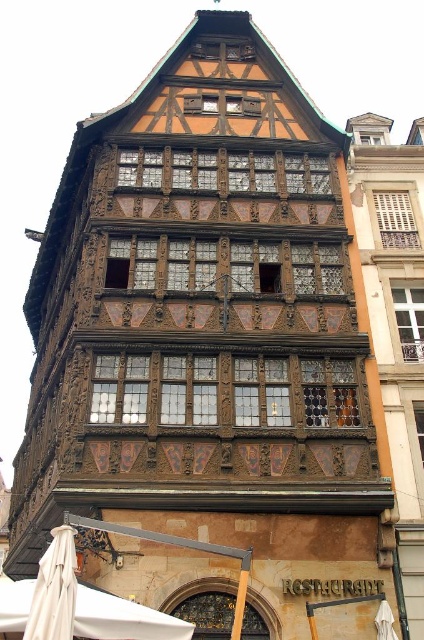
You are a tourist standing in front of the ornate building and notice two umbrellas. The beige fabric umbrella at lower left and the white fabric umbrella at lower right. Which one is taller?

The beige fabric umbrella at lower left is taller than the white fabric umbrella at lower right.

You are standing in front of the ornate building and see a point at coordinates (122, 618). Based on the scene description, what is the object located at that point?

The point at (122, 618) is located on the white fabric canopy at lower left.

You are standing at the entrance of the ornate building and want to locate the white fabric canopy at lower left. According to the coordinates provided, where should you look relative to your position?

The white fabric canopy at lower left is located at coordinates point (122, 618), which means it is positioned to the far right and slightly above the bottom center of the image.